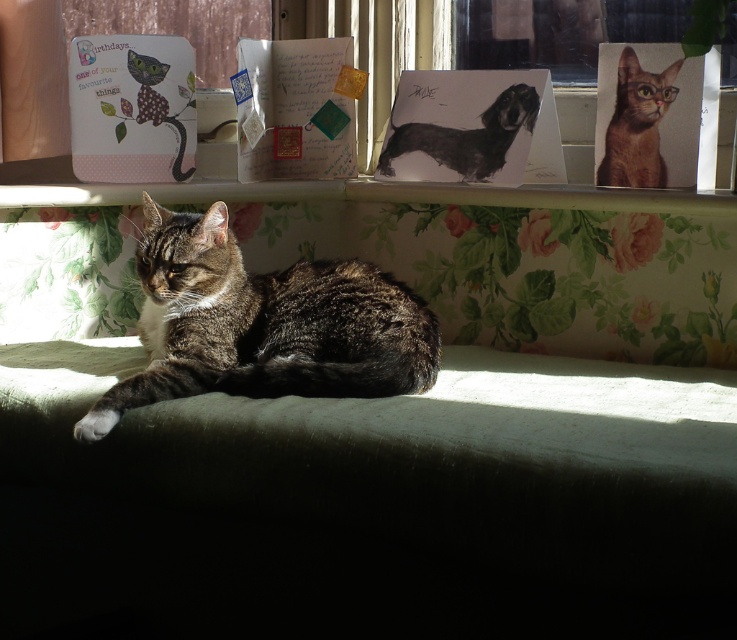
You are a delivery robot that is 2 feet tall. You need to deliver a package to the white glossy paper at upper center. Can you reach it?

The white glossy paper at upper center and viewer are 4.92 feet apart from each other. Since the robot is 2 feet tall, it can reach the white glossy paper at upper center as the height difference is within its capability.

You are a photographer trying to capture a photo of both the tabby fur cat at center and the brown glossy cat at upper right in the scene. Given their positions and sizes, can you fit both cats entirely within the camera frame without cropping either of them?

The tabby fur cat at center might be wider than brown glossy cat at upper right, so it depends on the camera frame size. If the frame is wide enough to accommodate the width of the wider tabby fur cat at center, then both can fit. Otherwise, they might not both fit without cropping.

Looking at this image, you are an interior designer arranging items on a shelf. You have the white glossy paper at upper center and the black glossy dog at upper center. According to the scene, which item is located to the left of the other?

The white glossy paper at upper center is positioned on the left side of black glossy dog at upper center.